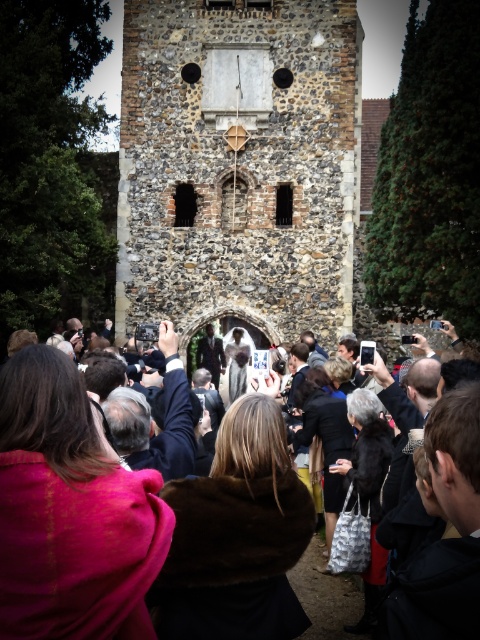
You are a photographer positioned at the back of the crowd. You want to take a photo of the dark brown fur coat at center and the stone clock tower at center. Which object should you move towards to get a better view of both?

You should move towards the stone clock tower at center because the dark brown fur coat at center is behind it, so moving closer to the tower will allow you to see both objects more clearly.

You are standing in front of the historic stone building and see the stone clock tower at center and the dark brown fur coat at center. Which object is closer to the building?

The dark brown fur coat at center is closer to the building because the stone clock tower at center is positioned over it, indicating it is above and farther away.